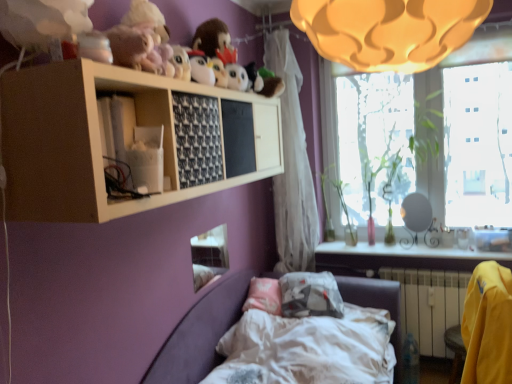
Question: Is yellow fabric chair at lower right a part of matte yellow lampshade at upper center?

Choices:
 (A) yes
 (B) no

Answer: (B)

Question: Does matte yellow lampshade at upper center have a smaller size compared to yellow fabric chair at lower right?

Choices:
 (A) yes
 (B) no

Answer: (B)

Question: Is matte yellow lampshade at upper center placed right next to yellow fabric chair at lower right?

Choices:
 (A) yes
 (B) no

Answer: (B)

Question: Can you confirm if matte yellow lampshade at upper center is taller than yellow fabric chair at lower right?

Choices:
 (A) no
 (B) yes

Answer: (A)

Question: Is the depth of matte yellow lampshade at upper center greater than that of yellow fabric chair at lower right?

Choices:
 (A) no
 (B) yes

Answer: (A)

Question: From the image's perspective, is yellow fabric chair at lower right located above or below yellow fabric armchair at lower right?

Choices:
 (A) above
 (B) below

Answer: (B)

Question: Based on their sizes in the image, would you say yellow fabric chair at lower right is bigger or smaller than yellow fabric armchair at lower right?

Choices:
 (A) small
 (B) big

Answer: (A)

Question: Is yellow fabric chair at lower right spatially inside yellow fabric armchair at lower right, or outside of it?

Choices:
 (A) outside
 (B) inside

Answer: (A)

Question: Considering the positions of point (456, 349) and point (463, 382), is point (456, 349) closer or farther from the camera than point (463, 382)?

Choices:
 (A) farther
 (B) closer

Answer: (A)

Question: Looking at their shapes, would you say yellow fabric armchair at lower right is wider or thinner than white plastic radiator at lower right?

Choices:
 (A) wide
 (B) thin

Answer: (A)

Question: Based on their positions, is yellow fabric armchair at lower right located to the left or right of white plastic radiator at lower right?

Choices:
 (A) right
 (B) left

Answer: (B)

Question: Would you say yellow fabric armchair at lower right is inside or outside white plastic radiator at lower right?

Choices:
 (A) outside
 (B) inside

Answer: (A)

Question: Relative to white plastic radiator at lower right, is yellow fabric armchair at lower right in front or behind?

Choices:
 (A) behind
 (B) front

Answer: (B)

Question: Does point (259, 349) appear closer or farther from the camera than point (111, 89)?

Choices:
 (A) closer
 (B) farther

Answer: (B)

Question: Considering the relative positions of velvet purple bed at lower center and white matte shelf at upper center in the image provided, is velvet purple bed at lower center to the left or to the right of white matte shelf at upper center?

Choices:
 (A) left
 (B) right

Answer: (B)